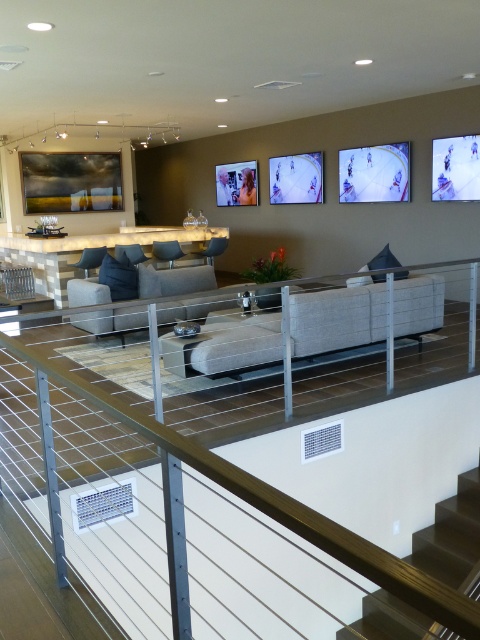
Question: Which of the following is the farthest from the observer?

Choices:
 (A) (295, 602)
 (B) (437, 285)

Answer: (B)

Question: Which of the following is the closest to the observer?

Choices:
 (A) dark wood stairs at lower right
 (B) neutral fabric couch at center

Answer: (A)

Question: Which of the following is the closest to the observer?

Choices:
 (A) dark wood stairs at lower right
 (B) neutral fabric couch at center

Answer: (A)

Question: Is white metal rail at lower center positioned before neutral fabric couch at center?

Choices:
 (A) yes
 (B) no

Answer: (A)

Question: Can you confirm if white metal rail at lower center is positioned below neutral fabric couch at center?

Choices:
 (A) no
 (B) yes

Answer: (B)

Question: From the image, what is the correct spatial relationship of white metal rail at lower center in relation to dark wood stairs at lower right?

Choices:
 (A) below
 (B) above

Answer: (B)